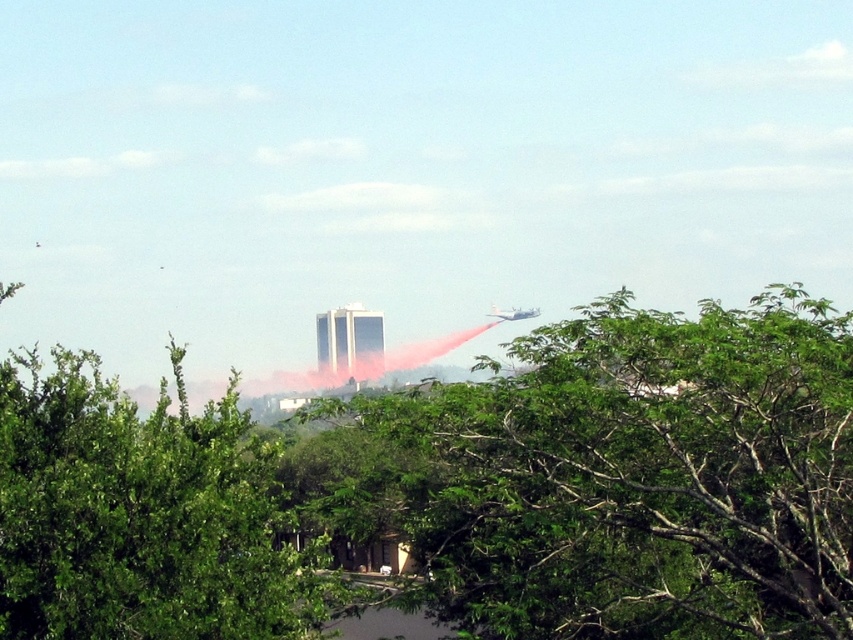
You are a firefighter assessing the situation from a safe distance. You notice the green leafy tree at center and the metallic silver airplane at upper right. How far apart are these two objects in meters?

The green leafy tree at center and metallic silver airplane at upper right are 125.90 meters apart from each other.

You are a firefighter observing the scene. You notice the green leafy tree at center and the metallic silver airplane at upper right. Which object would block your view of the other if you were standing closer to the smaller one?

The green leafy tree at center is larger than the metallic silver airplane at upper right. If you were standing closer to the smaller metallic silver airplane at upper right, the larger green leafy tree at center would block your view of the airplane.